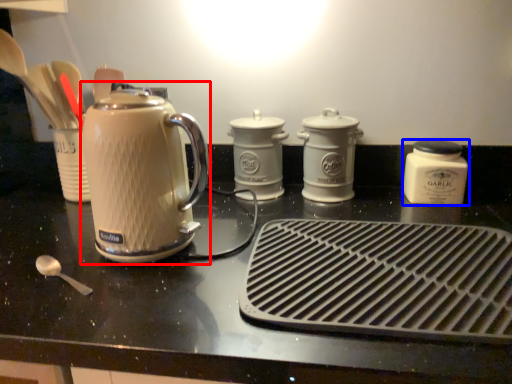
Question: Which object is closer to the camera taking this photo, kettle (highlighted by a red box) or kitchen appliance (highlighted by a blue box)?

Choices:
 (A) kettle
 (B) kitchen appliance

Answer: (A)